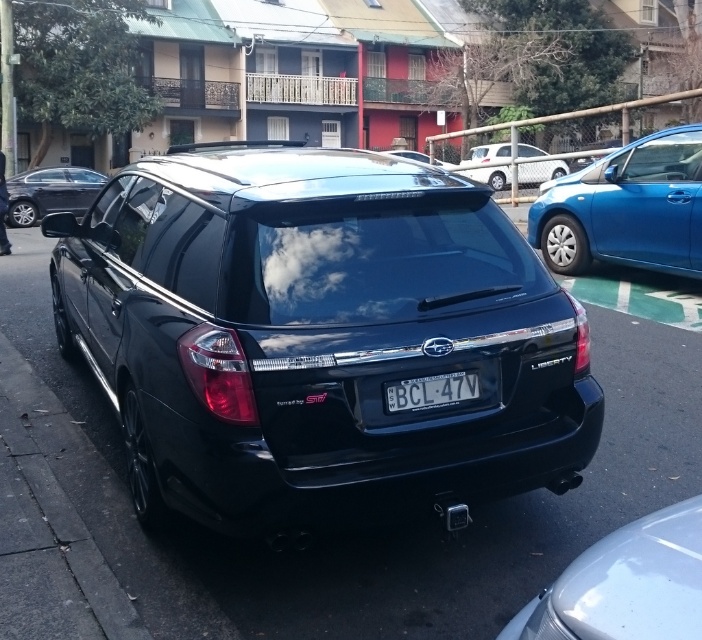
Which is more to the right, matte black car at center or matte black car at left?

matte black car at center

Which is below, matte black car at center or matte black car at left?

matte black car at center is lower down.

What do you see at coordinates (317, 339) in the screenshot? The height and width of the screenshot is (640, 702). I see `matte black car at center` at bounding box center [317, 339].

Identify the location of matte black car at center. click(x=317, y=339).

Does point (684, 275) come closer to viewer compared to point (397, 397)?

No, (684, 275) is behind (397, 397).

Is point (682, 269) behind point (388, 403)?

Yes.

Does point (557, 205) lie in front of point (395, 401)?

No, it is not.

At what (x,y) coordinates should I click in order to perform the action: click on blue metallic car at right. Please return your answer as a coordinate pair (x, y). Looking at the image, I should click on (625, 209).

Does matte black car at center appear on the left side of white plastic license plate at center?

Result: Indeed, matte black car at center is positioned on the left side of white plastic license plate at center.

Which is above, matte black car at center or white plastic license plate at center?

matte black car at center is above.

Does point (496, 378) come farther from viewer compared to point (411, 392)?

Yes.

This screenshot has width=702, height=640. Identify the location of matte black car at center. (317, 339).